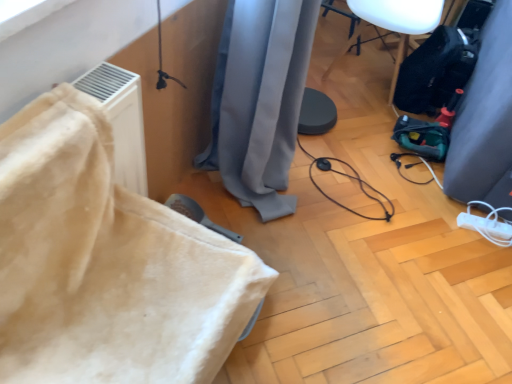
Question: Considering the relative sizes of white plastic extension cord at lower right and black plastic speaker at upper right, arranged as the second furniture when ordered from the bottom, in the image provided, is white plastic extension cord at lower right shorter than black plastic speaker at upper right, arranged as the second furniture when ordered from the bottom,?

Choices:
 (A) no
 (B) yes

Answer: (B)

Question: Is black plastic speaker at upper right, positioned as the first furniture in back-to-front order, located within white plastic extension cord at lower right?

Choices:
 (A) no
 (B) yes

Answer: (A)

Question: Is white plastic extension cord at lower right far from black plastic speaker at upper right, arranged as the 2th furniture when viewed from the left?

Choices:
 (A) no
 (B) yes

Answer: (A)

Question: Considering the relative positions of white plastic extension cord at lower right and black plastic speaker at upper right, arranged as the second furniture when ordered from the bottom, in the image provided, is white plastic extension cord at lower right to the right of black plastic speaker at upper right, arranged as the second furniture when ordered from the bottom, from the viewer's perspective?

Choices:
 (A) no
 (B) yes

Answer: (B)

Question: Considering the relative sizes of white plastic extension cord at lower right and black plastic speaker at upper right, arranged as the 2th furniture when viewed from the left, in the image provided, is white plastic extension cord at lower right smaller than black plastic speaker at upper right, arranged as the 2th furniture when viewed from the left,?

Choices:
 (A) yes
 (B) no

Answer: (A)

Question: From a real-world perspective, relative to gray fabric curtain at right, arranged as the second curtain when viewed from the left, is black plastic speaker at upper right, arranged as the 2th furniture when viewed from the front, vertically above or below?

Choices:
 (A) below
 (B) above

Answer: (A)

Question: Considering the positions of black plastic speaker at upper right, arranged as the 2th furniture when viewed from the front, and gray fabric curtain at right, the first curtain viewed from the right, in the image, is black plastic speaker at upper right, arranged as the 2th furniture when viewed from the front, wider or thinner than gray fabric curtain at right, the first curtain viewed from the right,?

Choices:
 (A) thin
 (B) wide

Answer: (B)

Question: In terms of height, does black plastic speaker at upper right, arranged as the 2th furniture when viewed from the front, look taller or shorter compared to gray fabric curtain at right, the first curtain viewed from the right?

Choices:
 (A) short
 (B) tall

Answer: (A)

Question: Based on their positions, is black plastic speaker at upper right, positioned as the first furniture in back-to-front order, located to the left or right of gray fabric curtain at right, arranged as the second curtain when viewed from the left?

Choices:
 (A) right
 (B) left

Answer: (B)

Question: From a real-world perspective, is black plastic speaker at upper right, positioned as the first furniture in back-to-front order, positioned above or below gray fabric curtain at center, which appears as the second curtain when viewed from the right?

Choices:
 (A) above
 (B) below

Answer: (B)

Question: Considering the relative positions of black plastic speaker at upper right, the first furniture in the top-to-bottom sequence, and gray fabric curtain at center, marked as the first curtain in a left-to-right arrangement, in the image provided, is black plastic speaker at upper right, the first furniture in the top-to-bottom sequence, to the left or to the right of gray fabric curtain at center, marked as the first curtain in a left-to-right arrangement,?

Choices:
 (A) left
 (B) right

Answer: (B)

Question: Based on their sizes in the image, would you say black plastic speaker at upper right, positioned as the first furniture in back-to-front order, is bigger or smaller than gray fabric curtain at center, which appears as the second curtain when viewed from the right?

Choices:
 (A) small
 (B) big

Answer: (A)

Question: Is black plastic speaker at upper right, arranged as the second furniture when ordered from the bottom, situated inside gray fabric curtain at center, marked as the first curtain in a left-to-right arrangement, or outside?

Choices:
 (A) outside
 (B) inside

Answer: (A)

Question: Is beige fabric couch at left, marked as the 1th furniture in a front-to-back arrangement, wider or thinner than black plastic speaker at upper right, arranged as the 2th furniture when viewed from the left?

Choices:
 (A) thin
 (B) wide

Answer: (B)

Question: Based on their positions, is beige fabric couch at left, marked as the 1th furniture in a bottom-to-top arrangement, located to the left or right of black plastic speaker at upper right, arranged as the 2th furniture when viewed from the front?

Choices:
 (A) left
 (B) right

Answer: (A)